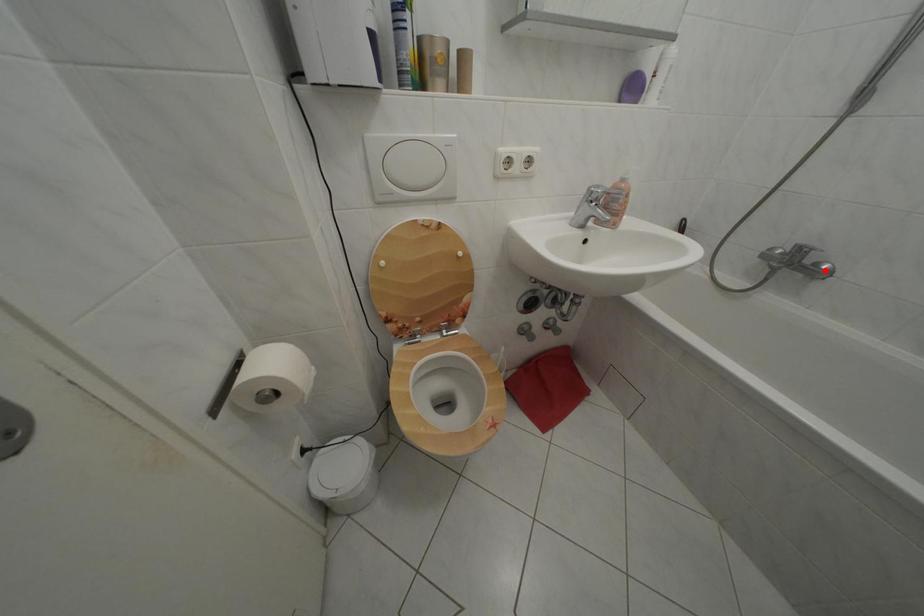
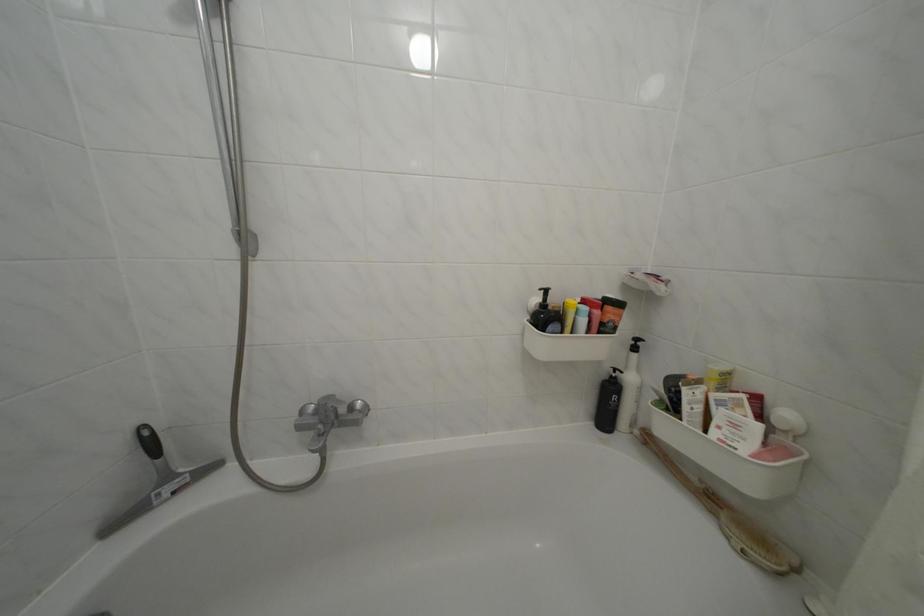
The point at the highlighted location is marked in the first image. Where is the corresponding point in the second image?

(359, 414)